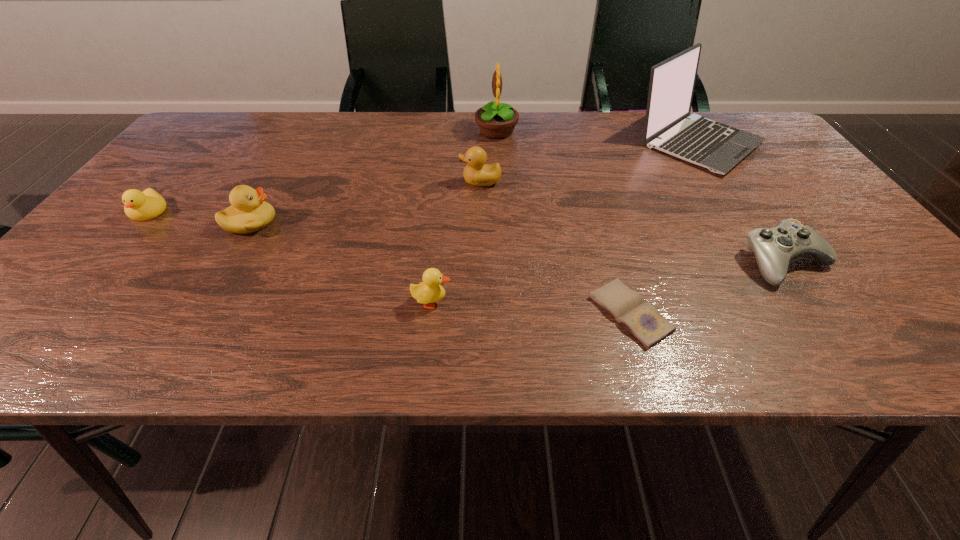
Where is `vacant space located 0.050m on the right of the control`? This screenshot has width=960, height=540. vacant space located 0.050m on the right of the control is located at coordinates (852, 262).

At what (x,y) coordinates should I click in order to perform the action: click on vacant space located 0.290m on the face of the leftmost object. Please return your answer as a coordinate pair (x, y). Image resolution: width=960 pixels, height=540 pixels. Looking at the image, I should click on (51, 327).

Locate an element on the screen. This screenshot has width=960, height=540. vacant space positioned 0.150m on the back of the sixth object from left to right is located at coordinates (606, 232).

Locate an element on the screen. laptop_computer that is at the far edge is located at coordinates (669, 127).

The width and height of the screenshot is (960, 540). What are the coordinates of `sunflower situated at the far edge` in the screenshot? It's located at (496, 120).

In order to click on object located in the near edge section of the desktop in this screenshot , I will do `click(641, 319)`.

Where is `object that is at the left edge`? object that is at the left edge is located at coordinates (140, 206).

Where is `laptop_computer that is at the right edge`? This screenshot has height=540, width=960. laptop_computer that is at the right edge is located at coordinates (669, 127).

Where is `control at the right edge`? The image size is (960, 540). control at the right edge is located at coordinates [774, 248].

Locate an element on the screen. object that is at the far right corner is located at coordinates (669, 127).